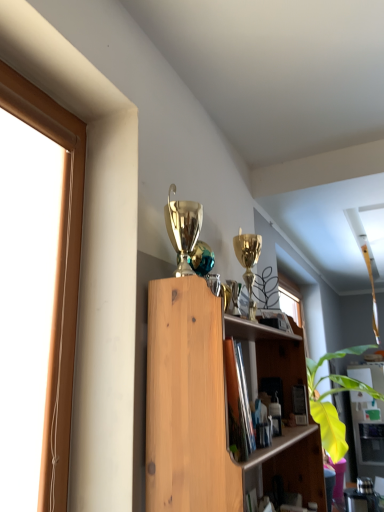
Question: Looking at their shapes, would you say wooden shelf at center is wider or thinner than matte wood cabinet at center?

Choices:
 (A) thin
 (B) wide

Answer: (A)

Question: From the image's perspective, is wooden shelf at center above or below matte wood cabinet at center?

Choices:
 (A) above
 (B) below

Answer: (A)

Question: From a real-world perspective, is wooden shelf at center above or below matte wood cabinet at center?

Choices:
 (A) below
 (B) above

Answer: (B)

Question: Is matte wood cabinet at center situated inside wooden shelf at center or outside?

Choices:
 (A) outside
 (B) inside

Answer: (A)

Question: Considering their positions, is matte wood cabinet at center located in front of or behind wooden shelf at center?

Choices:
 (A) behind
 (B) front

Answer: (A)

Question: Does point (365, 472) appear closer or farther from the camera than point (193, 492)?

Choices:
 (A) farther
 (B) closer

Answer: (A)

Question: Considering the positions of matte wood cabinet at center and wooden shelf at center in the image, is matte wood cabinet at center bigger or smaller than wooden shelf at center?

Choices:
 (A) big
 (B) small

Answer: (A)